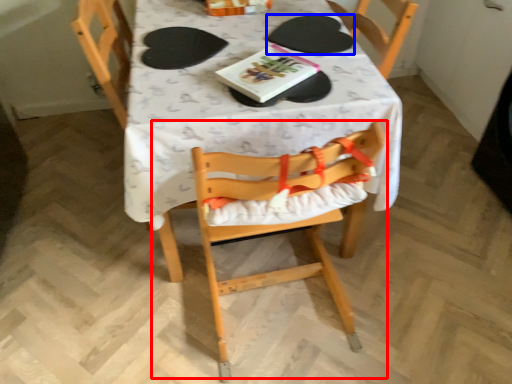
Question: Which of the following is the farthest to the observer, chair (highlighted by a red box) or paper plate (highlighted by a blue box)?

Choices:
 (A) chair
 (B) paper plate

Answer: (B)